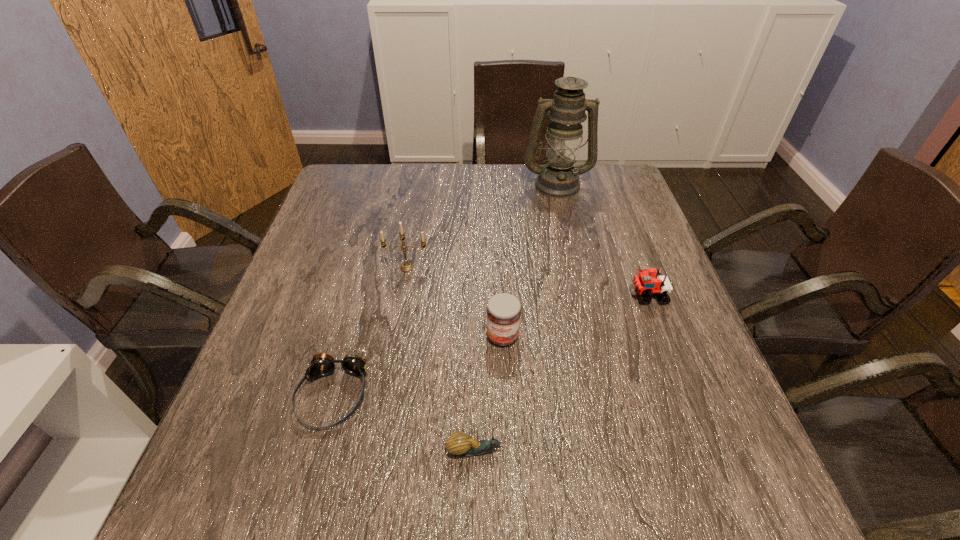
The image size is (960, 540). I want to click on the tallest object, so click(559, 178).

This screenshot has width=960, height=540. In order to click on the farthest object in this screenshot , I will do `click(559, 178)`.

Where is `the fifth shortest object`? the fifth shortest object is located at coordinates (406, 266).

This screenshot has height=540, width=960. Identify the location of candle. (406, 266).

This screenshot has width=960, height=540. Find the location of `the third nearest object`. the third nearest object is located at coordinates point(503,314).

Find the location of a particular element. Image resolution: width=960 pixels, height=540 pixels. the fourth shortest object is located at coordinates (503, 314).

This screenshot has width=960, height=540. Find the location of `the fourth tallest object`. the fourth tallest object is located at coordinates (644, 284).

The width and height of the screenshot is (960, 540). What are the coordinates of `Lego` in the screenshot? It's located at (644, 284).

Where is `the fifth farthest object`? The width and height of the screenshot is (960, 540). the fifth farthest object is located at coordinates (322, 365).

You are a GUI agent. You are given a task and a screenshot of the screen. Output one action in this format:
    pyautogui.click(x=<x>, y=<y>)
    Task: Click on the nearest object
    
    Given the screenshot: What is the action you would take?
    pyautogui.click(x=460, y=444)